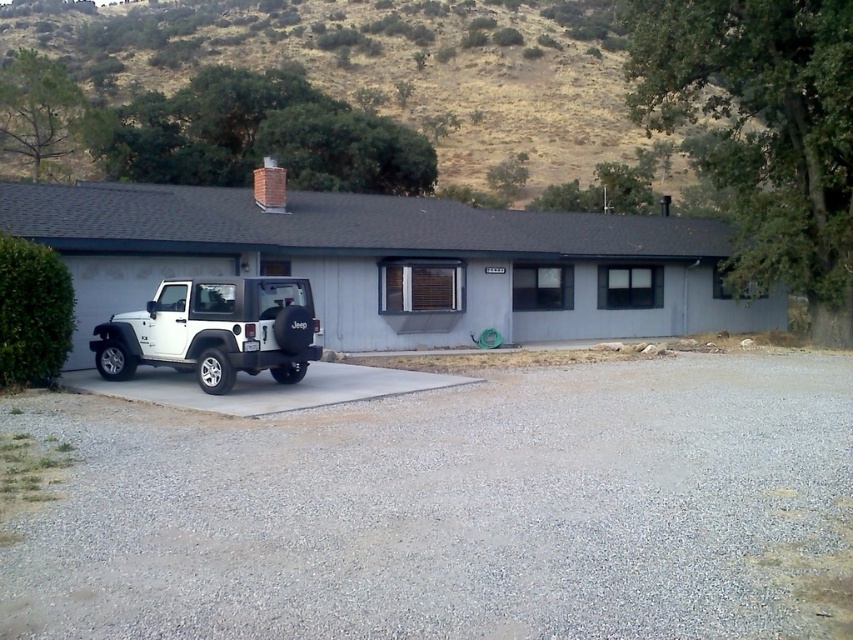
Question: Does white matte pickup truck at left appear on the left side of dried grass at upper center?

Choices:
 (A) yes
 (B) no

Answer: (B)

Question: Estimate the real-world distances between objects in this image. Which object is closer to the gray gravel at lower left?

Choices:
 (A) dried grass at upper center
 (B) white matte jeep at lower left

Answer: (B)

Question: Which point is closer to the camera?

Choices:
 (A) white matte pickup truck at left
 (B) white matte jeep at lower left

Answer: (B)

Question: Which point is farther from the camera taking this photo?

Choices:
 (A) (531, 157)
 (B) (184, 371)
 (C) (599, 253)
 (D) (68, 513)

Answer: (A)

Question: Is white matte pickup truck at left wider than dried grass at upper center?

Choices:
 (A) no
 (B) yes

Answer: (A)

Question: Where is gray gravel at lower left located in relation to dried grass at upper center in the image?

Choices:
 (A) right
 (B) left

Answer: (A)